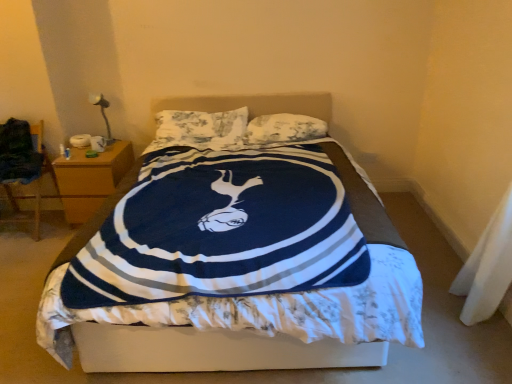
Question: Considering the relative sizes of fluffy white pillow at center, which ranks as the second pillow in left-to-right order, and fluffy white pillow at center, placed as the first pillow when sorted from left to right, in the image provided, is fluffy white pillow at center, which ranks as the second pillow in left-to-right order, thinner than fluffy white pillow at center, placed as the first pillow when sorted from left to right,?

Choices:
 (A) yes
 (B) no

Answer: (A)

Question: Can you confirm if fluffy white pillow at center, which is the 1th pillow in right-to-left order, is taller than fluffy white pillow at center, the second pillow viewed from the right?

Choices:
 (A) yes
 (B) no

Answer: (B)

Question: Are fluffy white pillow at center, which is the 1th pillow in right-to-left order, and fluffy white pillow at center, the second pillow viewed from the right, located far from each other?

Choices:
 (A) no
 (B) yes

Answer: (A)

Question: Is fluffy white pillow at center, the second pillow viewed from the right, completely or partially inside fluffy white pillow at center, which ranks as the second pillow in left-to-right order?

Choices:
 (A) yes
 (B) no

Answer: (B)

Question: Are fluffy white pillow at center, which ranks as the second pillow in left-to-right order, and fluffy white pillow at center, placed as the first pillow when sorted from left to right, making contact?

Choices:
 (A) yes
 (B) no

Answer: (B)

Question: Does fluffy white pillow at center, which is the 1th pillow in right-to-left order, have a lesser height compared to fluffy white pillow at center, placed as the first pillow when sorted from left to right?

Choices:
 (A) yes
 (B) no

Answer: (A)

Question: Is wooden nightstand at left positioned in front of metallic silver table lamp at upper left?

Choices:
 (A) yes
 (B) no

Answer: (A)

Question: Is wooden nightstand at left surrounding metallic silver table lamp at upper left?

Choices:
 (A) yes
 (B) no

Answer: (B)

Question: From the image's perspective, is wooden nightstand at left over metallic silver table lamp at upper left?

Choices:
 (A) no
 (B) yes

Answer: (A)

Question: Does wooden nightstand at left have a greater width compared to metallic silver table lamp at upper left?

Choices:
 (A) yes
 (B) no

Answer: (A)

Question: Is wooden nightstand at left bigger than metallic silver table lamp at upper left?

Choices:
 (A) yes
 (B) no

Answer: (A)

Question: From a real-world perspective, is wooden nightstand at left over metallic silver table lamp at upper left?

Choices:
 (A) yes
 (B) no

Answer: (B)

Question: Is fluffy white pillow at center, which is the 1th pillow in right-to-left order, at the back of white fabric at lower right?

Choices:
 (A) no
 (B) yes

Answer: (A)